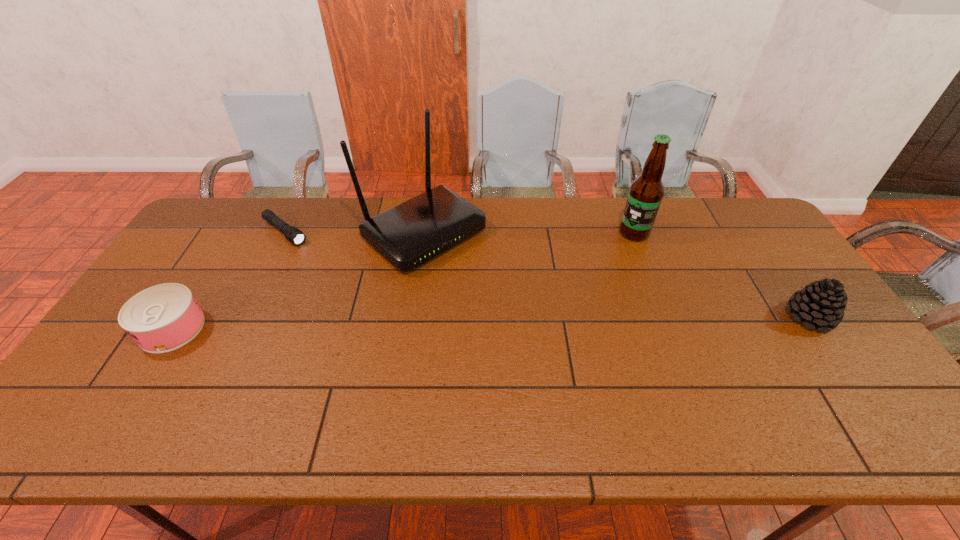
Where is `can`? can is located at coordinates coord(164,317).

Locate an element on the screen. the second shortest object is located at coordinates (164, 317).

Image resolution: width=960 pixels, height=540 pixels. I want to click on the third shortest object, so click(821, 304).

Identify the location of pinecone. This screenshot has width=960, height=540. (821, 304).

The image size is (960, 540). Identify the location of the third object from left to right. (408, 235).

Find the location of a particular element. The height and width of the screenshot is (540, 960). beer bottle is located at coordinates (646, 192).

I want to click on flashlight, so click(x=292, y=234).

Find the location of a particular element. The image size is (960, 540). the second object from left to right is located at coordinates (292, 234).

In order to click on free spot located 0.390m on the right of the fourth tallest object in this screenshot , I will do `click(348, 328)`.

Find the location of a particular element. free region located 0.350m on the front-facing side of the router is located at coordinates (550, 330).